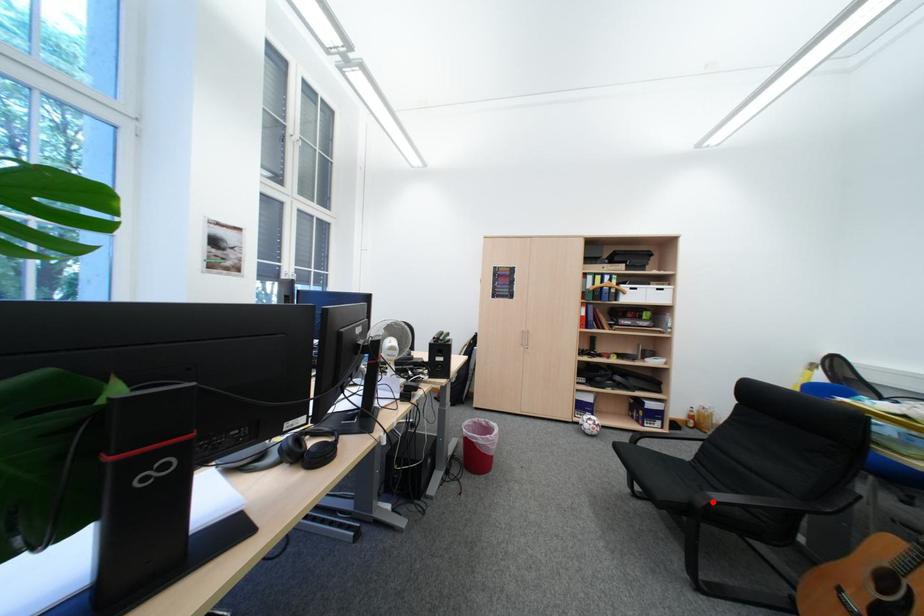
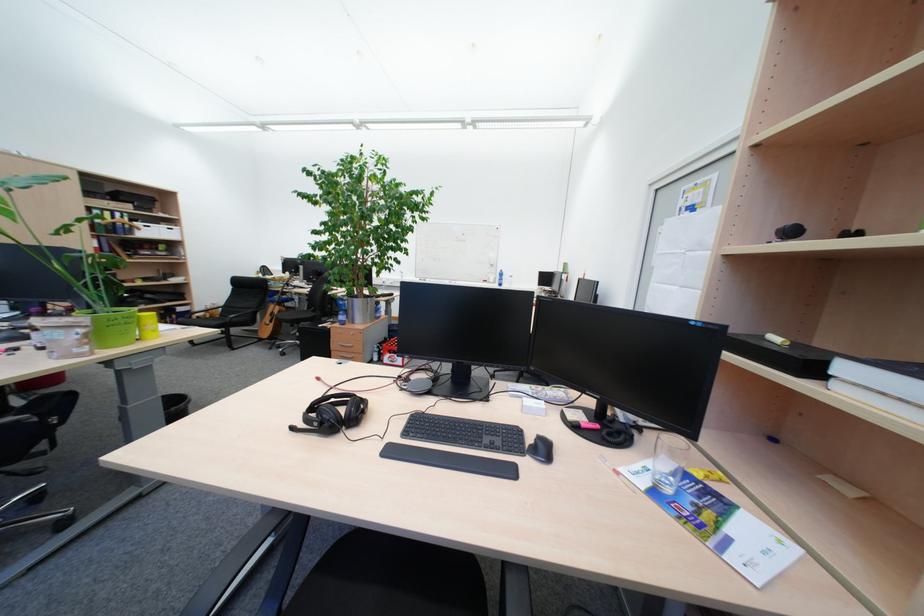
Question: A red point is marked in image1. In image2, is the corresponding 3D point closer to the camera or farther? Reply with the corresponding letter.

Choices:
 (A) The corresponding 3D point is closer.
 (B) The corresponding 3D point is farther.

Answer: (A)